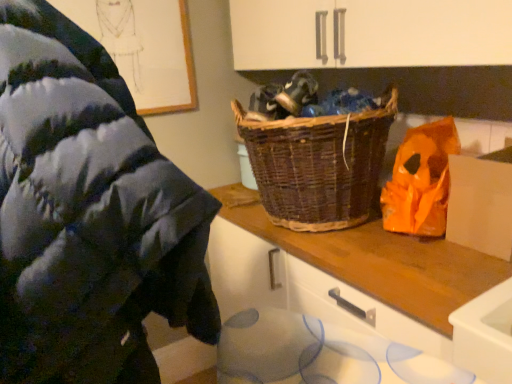
Measure the distance between woolen sweater at upper left and camera.

woolen sweater at upper left is 18.58 inches away from camera.

The image size is (512, 384). Find the location of `orange plastic bag at right`. orange plastic bag at right is located at coordinates (421, 180).

Identify the location of white cardboard at right. Image resolution: width=512 pixels, height=384 pixels. (481, 203).

Looking at this image, is woolen sweater at upper left completely or partially outside of white cardboard at right?

Yes, woolen sweater at upper left is not within white cardboard at right.

Is woolen sweater at upper left at the left side of white cardboard at right?

Correct, you'll find woolen sweater at upper left to the left of white cardboard at right.

Which of these two, woolen sweater at upper left or white cardboard at right, stands taller?

woolen sweater at upper left is taller.

Considering the sizes of woolen sweater at upper left and orange plastic bag at right in the image, is woolen sweater at upper left wider or thinner than orange plastic bag at right?

Clearly, woolen sweater at upper left has more width compared to orange plastic bag at right.

Can you tell me how much woolen sweater at upper left and orange plastic bag at right differ in facing direction?

The angle between the facing direction of woolen sweater at upper left and the facing direction of orange plastic bag at right is 88.9 degrees.

Is the surface of woolen sweater at upper left in direct contact with orange plastic bag at right?

woolen sweater at upper left and orange plastic bag at right are not in contact.

In terms of height, does woolen sweater at upper left look taller or shorter compared to orange plastic bag at right?

Clearly, woolen sweater at upper left is taller compared to orange plastic bag at right.

Is woven brown picnic basket at center facing towards orange plastic bag at right?

No.

Considering the sizes of objects woven brown picnic basket at center and orange plastic bag at right in the image provided, who is bigger, woven brown picnic basket at center or orange plastic bag at right?

Bigger between the two is woven brown picnic basket at center.

Consider the image. Which is nearer, (386, 109) or (416, 201)?

Positioned in front is point (416, 201).

Is woven brown picnic basket at center positioned beyond the bounds of orange plastic bag at right?

Yes, woven brown picnic basket at center is located beyond the bounds of orange plastic bag at right.

Is woolen sweater at upper left at the back of woven brown picnic basket at center?

No, woven brown picnic basket at center's orientation is not away from woolen sweater at upper left.

Is point (274, 217) positioned behind point (98, 231)?

Yes.

I want to click on picnic basket that appears above the woolen sweater at upper left (from a real-world perspective), so click(x=318, y=165).

Is woven brown picnic basket at center not within woolen sweater at upper left?

woven brown picnic basket at center is positioned outside woolen sweater at upper left.

Is woolen sweater at upper left to the left of woven brown picnic basket at center from the viewer's perspective?

Indeed, woolen sweater at upper left is positioned on the left side of woven brown picnic basket at center.

In order to click on wool below the woven brown picnic basket at center (from a real-world perspective) in this screenshot , I will do `click(88, 215)`.

How many degrees apart are the facing directions of woolen sweater at upper left and woven brown picnic basket at center?

The angular difference between woolen sweater at upper left and woven brown picnic basket at center is 94.6 degrees.

Is woolen sweater at upper left closer to camera compared to woven brown picnic basket at center?

Yes, woolen sweater at upper left is in front of woven brown picnic basket at center.

Would you say orange plastic bag at right is to the left or to the right of white cardboard at right in the picture?

orange plastic bag at right is to the left of white cardboard at right.

From the picture: Considering the relative positions of orange plastic bag at right and white cardboard at right in the image provided, is orange plastic bag at right behind white cardboard at right?

Yes, orange plastic bag at right is further from the viewer.

Which of these two, orange plastic bag at right or white cardboard at right, is thinner?

orange plastic bag at right.

Where is `cardboard box that appears below the orange plastic bag at right (from a real-world perspective)`? This screenshot has width=512, height=384. cardboard box that appears below the orange plastic bag at right (from a real-world perspective) is located at coordinates (481, 203).

What's the angular difference between white cardboard at right and woolen sweater at upper left's facing directions?

They differ by 88.9 degrees in their facing directions.

In the scene shown: Could you tell me if white cardboard at right is turned towards woolen sweater at upper left?

Yes, white cardboard at right is aimed at woolen sweater at upper left.

Which is further, (478, 164) or (0, 86)?

Point (478, 164)

Identify the location of cardboard box located on the right of woolen sweater at upper left. (481, 203).

The image size is (512, 384). Find the location of `cardboard box above the woolen sweater at upper left (from the image's perspective)`. cardboard box above the woolen sweater at upper left (from the image's perspective) is located at coordinates (481, 203).

Find the location of a particular element. The height and width of the screenshot is (384, 512). wool located in front of the orange plastic bag at right is located at coordinates (88, 215).

Based on their spatial positions, is woolen sweater at upper left or orange plastic bag at right further from white cardboard at right?

woolen sweater at upper left is further to white cardboard at right.

Considering their positions, is white cardboard at right positioned further to orange plastic bag at right than woven brown picnic basket at center?

The object further to orange plastic bag at right is woven brown picnic basket at center.

When comparing their distances from orange plastic bag at right, does woven brown picnic basket at center or white cardboard at right seem further?

woven brown picnic basket at center is positioned further to the anchor orange plastic bag at right.

Which object lies nearer to the anchor point woolen sweater at upper left, white cardboard at right or orange plastic bag at right?

Based on the image, orange plastic bag at right appears to be nearer to woolen sweater at upper left.

Estimate the real-world distances between objects in this image. Which object is further from woven brown picnic basket at center, orange plastic bag at right or woolen sweater at upper left?

woolen sweater at upper left lies further to woven brown picnic basket at center than the other object.

From the picture: From the image, which object appears to be farther from woven brown picnic basket at center, white cardboard at right or woolen sweater at upper left?

Among the two, woolen sweater at upper left is located further to woven brown picnic basket at center.

Based on their spatial positions, is woven brown picnic basket at center or woolen sweater at upper left further from white cardboard at right?

woolen sweater at upper left lies further to white cardboard at right than the other object.

Estimate the real-world distances between objects in this image. Which object is closer to woolen sweater at upper left, orange plastic bag at right or woven brown picnic basket at center?

woven brown picnic basket at center is closer to woolen sweater at upper left.

This screenshot has width=512, height=384. In order to click on waste between woolen sweater at upper left and white cardboard at right from left to right in this screenshot , I will do `click(421, 180)`.

You are a GUI agent. You are given a task and a screenshot of the screen. Output one action in this format:
    pyautogui.click(x=<x>, y=<y>)
    Task: Click on the picnic basket between woolen sweater at upper left and white cardboard at right in the horizontal direction
    This screenshot has height=384, width=512.
    Given the screenshot: What is the action you would take?
    pyautogui.click(x=318, y=165)

Find the location of a particular element. This screenshot has width=512, height=384. picnic basket between woolen sweater at upper left and orange plastic bag at right in the front-back direction is located at coordinates (318, 165).

The height and width of the screenshot is (384, 512). Identify the location of waste situated between woven brown picnic basket at center and white cardboard at right from left to right. (421, 180).